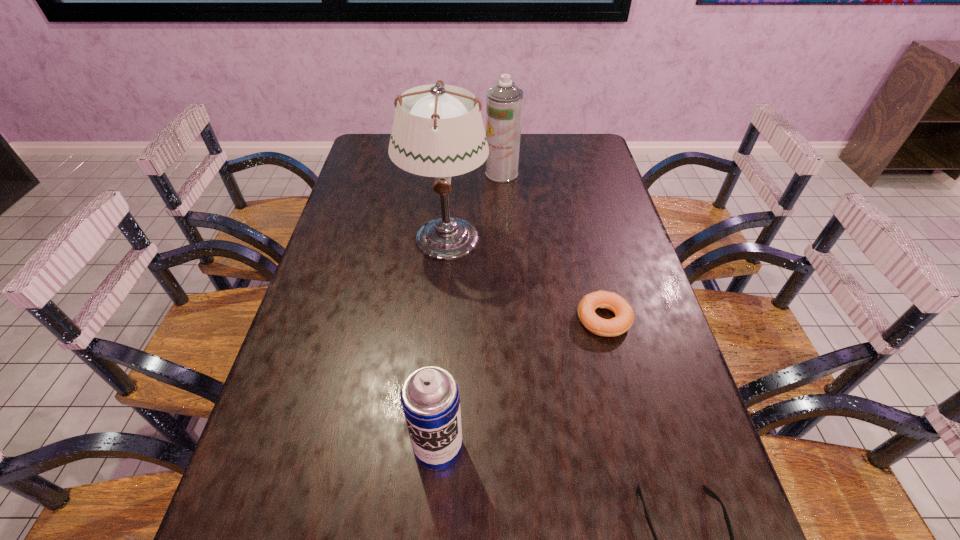
Locate an element on the screen. Image resolution: width=960 pixels, height=540 pixels. the tallest object is located at coordinates (438, 131).

You are a GUI agent. You are given a task and a screenshot of the screen. Output one action in this format:
    pyautogui.click(x=<x>, y=<y>)
    Task: Click on the fourth nearest object
    Image resolution: width=960 pixels, height=540 pixels.
    Given the screenshot: What is the action you would take?
    pyautogui.click(x=438, y=131)

In order to click on the farthest object in this screenshot , I will do `click(504, 103)`.

The image size is (960, 540). Find the location of `the right aerosol can`. the right aerosol can is located at coordinates (504, 103).

You are a GUI agent. You are given a task and a screenshot of the screen. Output one action in this format:
    pyautogui.click(x=<x>, y=<y>)
    Task: Click on the nearer aerosol can
    
    Given the screenshot: What is the action you would take?
    pyautogui.click(x=430, y=399)

The image size is (960, 540). Find the location of `the fourth farthest object`. the fourth farthest object is located at coordinates (430, 399).

In order to click on bagel in this screenshot , I will do (x=624, y=315).

Identify the location of vacant space located 0.140m on the lampshade of the lampshade. (440, 307).

The height and width of the screenshot is (540, 960). In order to click on vacant point located 0.050m on the front of the farther aerosol can in this screenshot , I will do `click(503, 191)`.

Identify the location of free space located 0.050m on the label side of the left aerosol can. (435, 500).